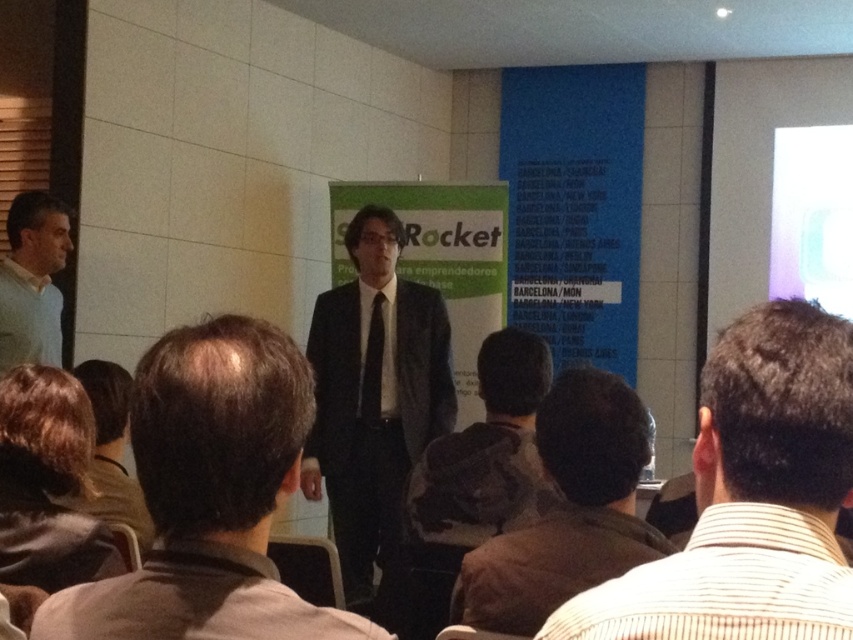
You are an event organizer and need to seat two VIP guests. The first guest prefers a seat that is closer to the speaker and the second prefers a seat that is farther away. Given the dark brown suit at center and the light blue sweater at left, which guest should sit where?

The dark brown suit at center is smaller than the light blue sweater at left, so the VIP guest who prefers a closer seat should sit where the dark brown suit at center is, and the other guest should sit where the light blue sweater at left is.

You are an attendee at the presentation. You notice two points marked in the room. The first is at coordinate point (641, 408) and the second is at coordinate point (451, 444). Which point is closer to the speaker?

Point (641, 408) is in front of point (451, 444), so it is closer to the speaker.

You are sitting in the audience at the presentation. You want to look at the speaker who is standing at point (544, 524). Is the speaker closer to you than 6 feet?

The speaker at point (544, 524) is 5.31 feet away from the viewer, so yes, the speaker is closer than 6 feet.